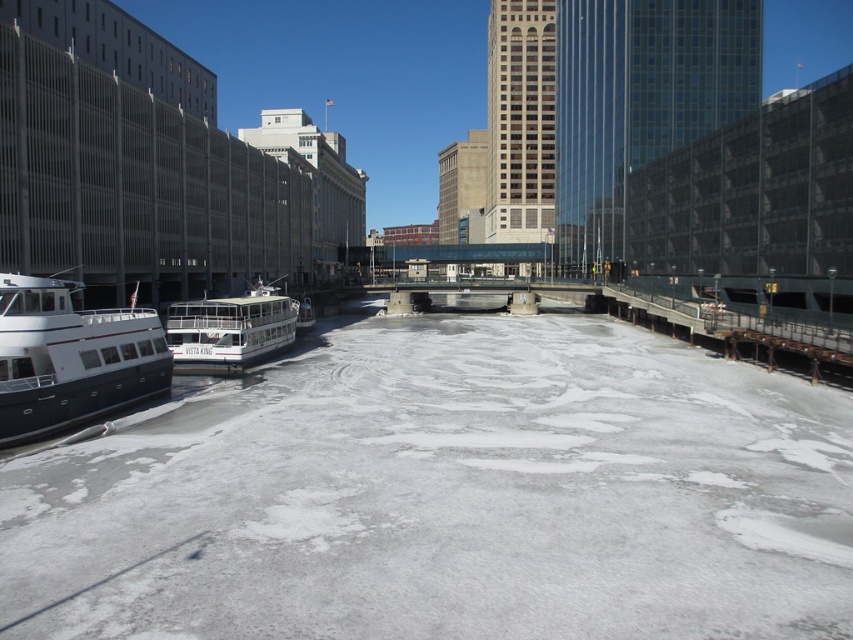
Does matte white boat at left appear on the left side of white matte boat at center?

In fact, matte white boat at left is to the right of white matte boat at center.

Looking at this image, can you confirm if matte white boat at left is positioned to the right of white matte boat at center?

Indeed, matte white boat at left is positioned on the right side of white matte boat at center.

The width and height of the screenshot is (853, 640). I want to click on matte white boat at left, so click(x=71, y=356).